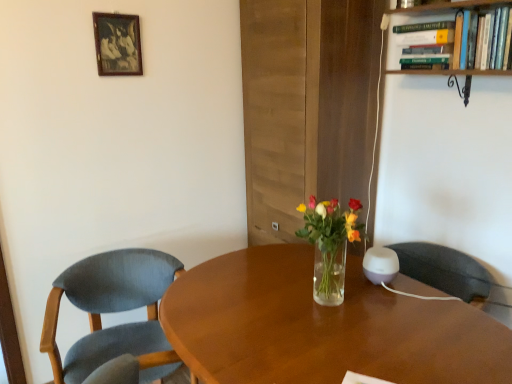
Question: In the image, is textured blue fabric chair at left on the left side or the right side of wooden picture frame at upper left?

Choices:
 (A) right
 (B) left

Answer: (A)

Question: From a real-world perspective, is textured blue fabric chair at left physically located above or below wooden picture frame at upper left?

Choices:
 (A) above
 (B) below

Answer: (B)

Question: Which of these objects is positioned closest to the textured blue fabric chair at left?

Choices:
 (A) wooden desk at center
 (B) clear glass vase at center
 (C) wooden picture frame at upper left
 (D) green hardcover book at upper right
 (E) wooden bookshelf at upper right

Answer: (A)

Question: Which is farther from the clear glass vase at center?

Choices:
 (A) wooden picture frame at upper left
 (B) green hardcover book at upper right
 (C) wooden desk at center
 (D) textured blue fabric chair at left
 (E) wooden bookshelf at upper right

Answer: (A)